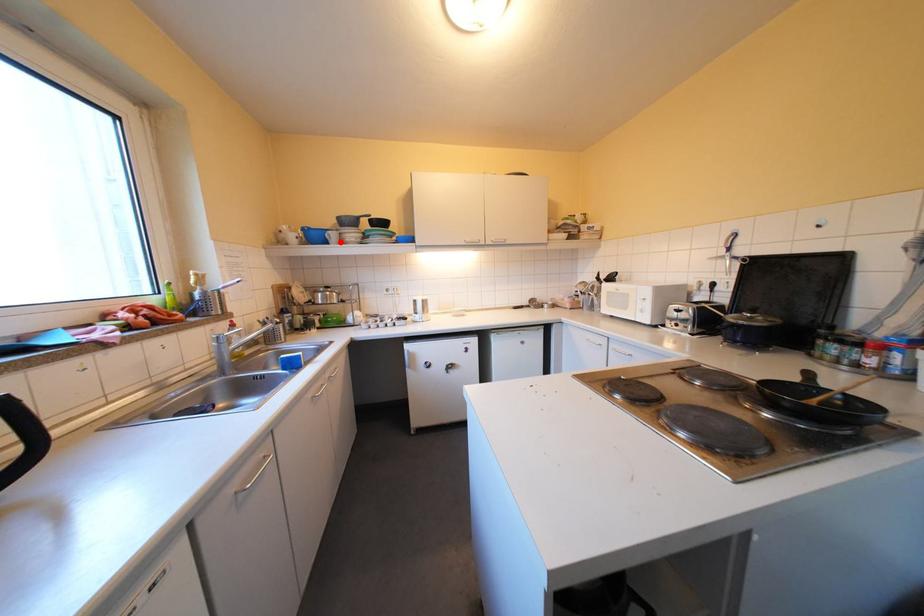
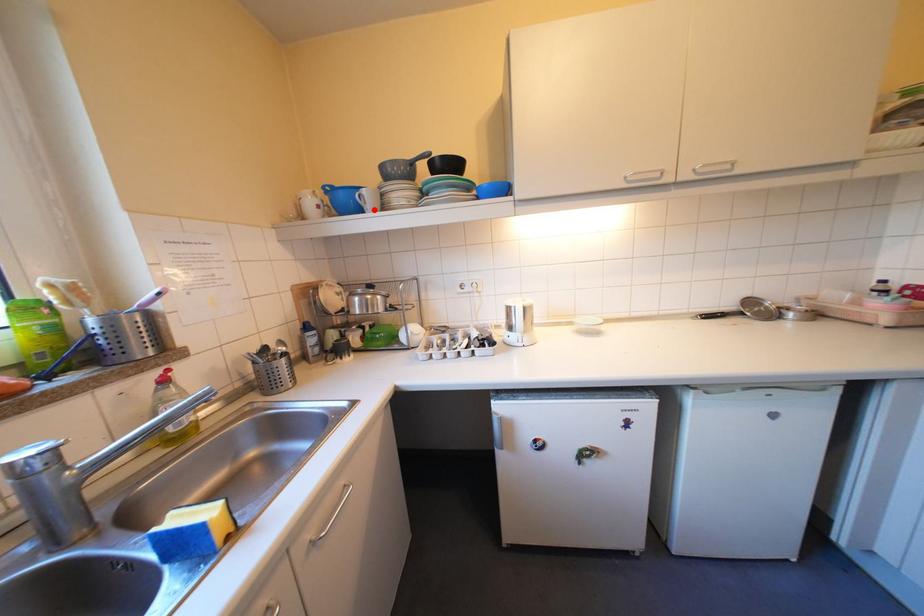
I am providing you with two images of the same scene from different viewpoints. A red point is marked on the first image and another point is marked on the second image. Do the highlighted points in image1 and image2 indicate the same real-world spot?

Yes